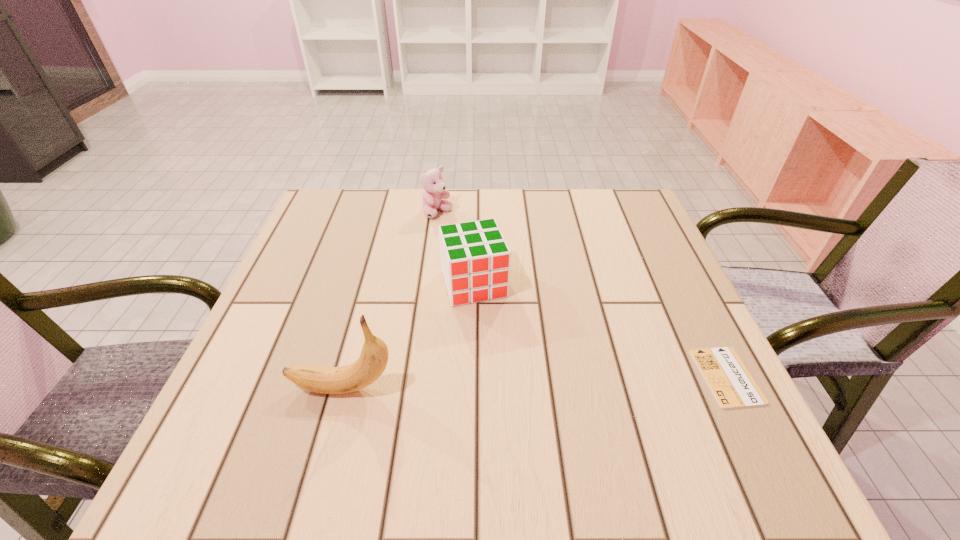
The width and height of the screenshot is (960, 540). In order to click on object that is at the near left corner in this screenshot , I will do `click(373, 359)`.

Where is `object present at the near right corner`? The height and width of the screenshot is (540, 960). object present at the near right corner is located at coordinates (732, 385).

Identify the location of blank space at the far edge of the desktop. The image size is (960, 540). (578, 190).

The height and width of the screenshot is (540, 960). Find the location of `vacant area at the near edge`. vacant area at the near edge is located at coordinates (583, 386).

Identify the location of free space at the left edge of the desktop. This screenshot has width=960, height=540. (297, 253).

In the image, there is a desktop. Identify the location of free space at the right edge. (670, 289).

The height and width of the screenshot is (540, 960). In the image, there is a desktop. In order to click on vacant space at the far left corner in this screenshot , I will do `click(309, 220)`.

Image resolution: width=960 pixels, height=540 pixels. In the image, there is a desktop. In order to click on vacant space at the far right corner in this screenshot , I will do `click(628, 230)`.

Locate an element on the screen. The height and width of the screenshot is (540, 960). vacant space at the near right corner is located at coordinates (682, 388).

The width and height of the screenshot is (960, 540). I want to click on empty space that is in between the cube and the tallest object, so click(408, 336).